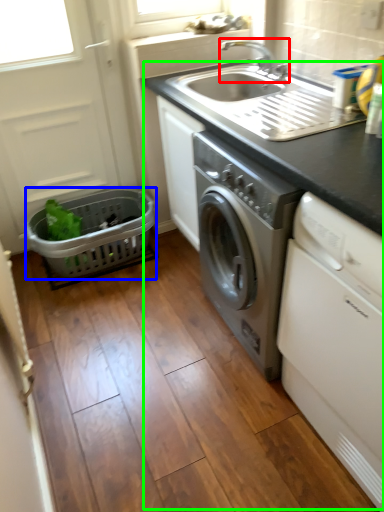
Question: Considering the real-world distances, which object is closest to tap (highlighted by a red box)? basket (highlighted by a blue box) or appliance (highlighted by a green box).

Choices:
 (A) basket
 (B) appliance

Answer: (B)